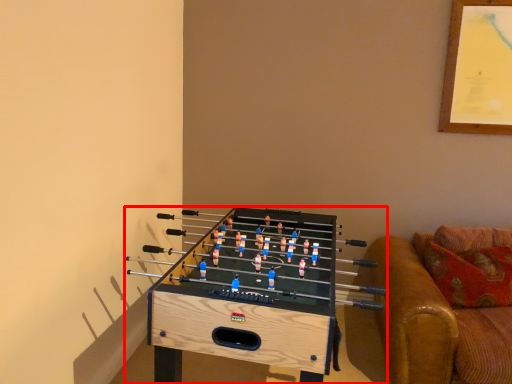
Question: From the image's perspective, what is the correct spatial positioning of furniture (annotated by the red box) in reference to studio couch?

Choices:
 (A) above
 (B) below

Answer: (B)